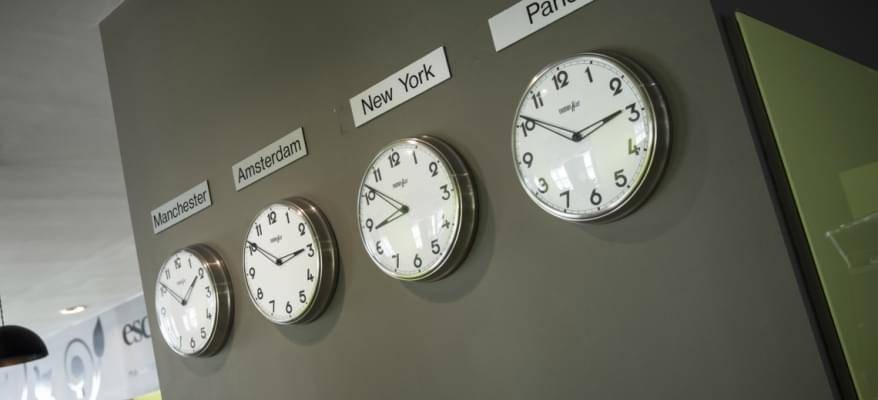
Locate an element on the screen. Image resolution: width=878 pixels, height=400 pixels. grey wall is located at coordinates (739, 201).